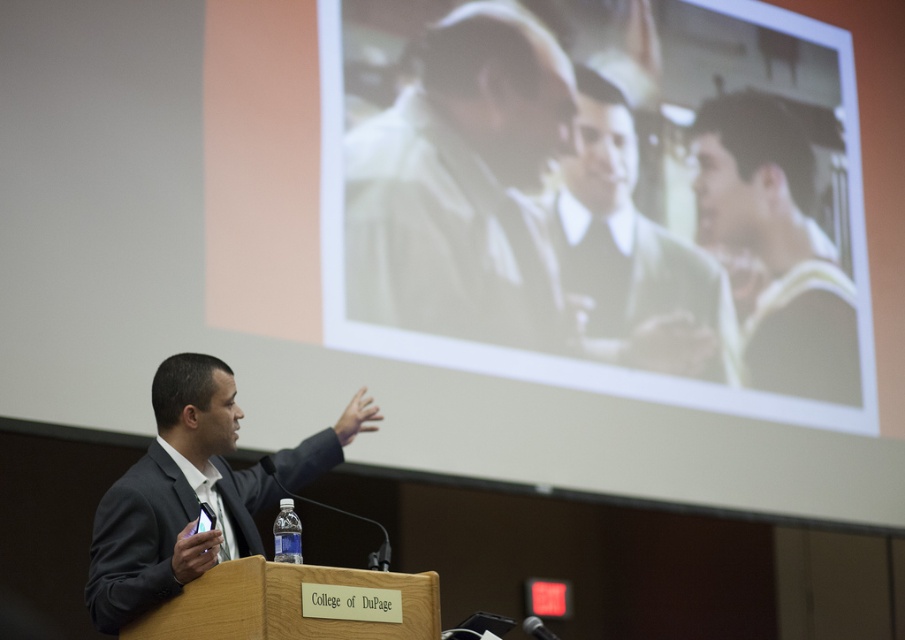
Question: Which of the following is the closest to the observer?

Choices:
 (A) (132, 515)
 (B) (754, 172)
 (C) (738, 33)
 (D) (492, 186)

Answer: (A)

Question: Which point appears farthest from the camera in this image?

Choices:
 (A) (589, 138)
 (B) (701, 340)
 (C) (475, 276)

Answer: (B)

Question: Where is matte black tie at upper right located in relation to dark gray suit at center in the image?

Choices:
 (A) right
 (B) left

Answer: (A)

Question: Can you confirm if matte white screen at upper center is thinner than dark gray suit at center?

Choices:
 (A) no
 (B) yes

Answer: (A)

Question: Which of the following is the closest to the observer?

Choices:
 (A) light beige suit at center
 (B) light beige fabric shirt at center

Answer: (B)

Question: In this image, where is matte white screen at upper center located relative to light beige suit at center?

Choices:
 (A) left
 (B) right

Answer: (A)